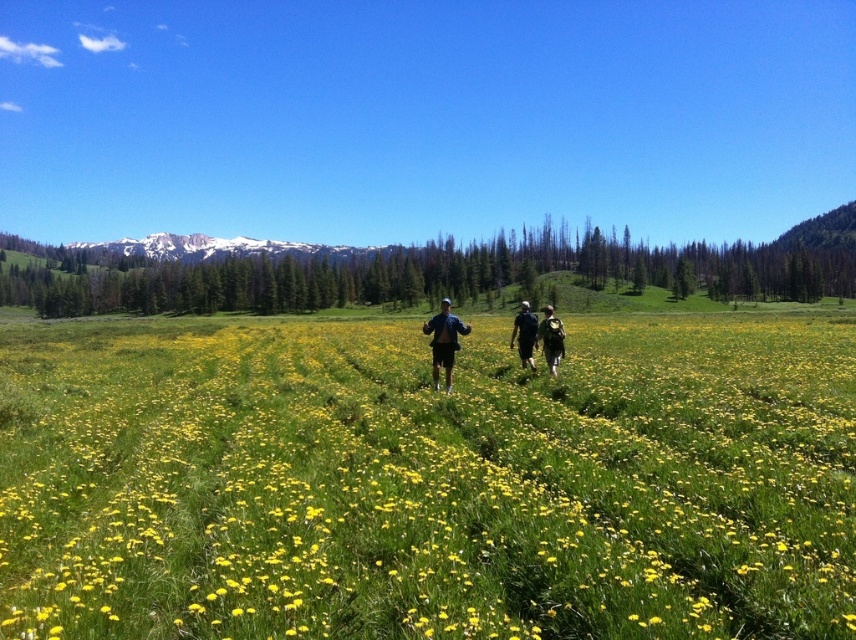
Question: Considering the relative positions of matte black backpacks at center and denim jacket at center in the image provided, where is matte black backpacks at center located with respect to denim jacket at center?

Choices:
 (A) right
 (B) left

Answer: (A)

Question: Which of the following is the farthest from the observer?

Choices:
 (A) yellow grass at center
 (B) black fabric backpack at center
 (C) matte black backpacks at center

Answer: (B)

Question: Which object is positioned farthest from the matte black backpack at center?

Choices:
 (A) denim jacket at center
 (B) matte black backpacks at center
 (C) black fabric backpack at center

Answer: (A)

Question: Considering the real-world distances, which object is farthest from the black fabric backpack at center?

Choices:
 (A) matte black backpack at center
 (B) matte black backpacks at center
 (C) yellow grass at center

Answer: (C)

Question: Is yellow grass at center thinner than matte black backpacks at center?

Choices:
 (A) yes
 (B) no

Answer: (B)

Question: Can you confirm if matte black backpacks at center is positioned to the right of matte black backpack at center?

Choices:
 (A) yes
 (B) no

Answer: (B)